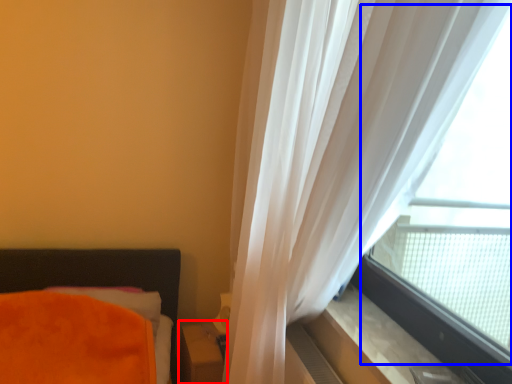
Question: Which object is further to the camera taking this photo, table (highlighted by a red box) or bay window (highlighted by a blue box)?

Choices:
 (A) table
 (B) bay window

Answer: (A)